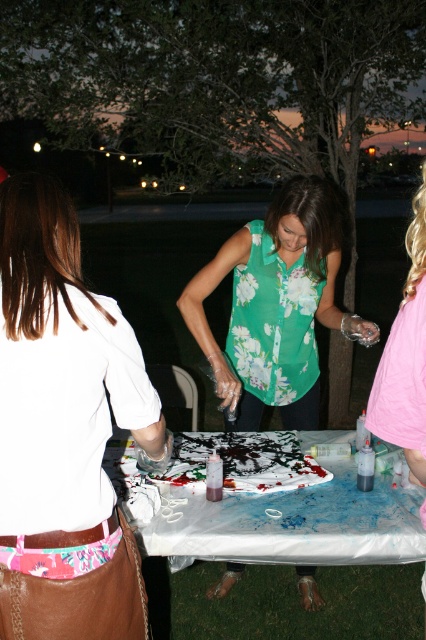
Is white plastic picnic table at center below floral fabric blouse at center?

Correct, white plastic picnic table at center is located below floral fabric blouse at center.

Does white plastic picnic table at center lie in front of floral fabric blouse at center?

No, white plastic picnic table at center is behind floral fabric blouse at center.

This screenshot has width=426, height=640. What do you see at coordinates (288, 563) in the screenshot?
I see `white plastic picnic table at center` at bounding box center [288, 563].

Locate an element on the screen. The width and height of the screenshot is (426, 640). white plastic picnic table at center is located at coordinates (288, 563).

Does point (75, 294) come behind point (380, 368)?

No.

Which is more to the right, white leather purse at lower left or floral fabric blouse at center?

floral fabric blouse at center is more to the right.

This screenshot has height=640, width=426. I want to click on white leather purse at lower left, so click(65, 429).

Who is shorter, white leather purse at lower left or floral green blouse at center?

Standing shorter between the two is white leather purse at lower left.

Is white leather purse at lower left bigger than floral green blouse at center?

No.

Who is more forward, (48, 477) or (209, 282)?

Point (48, 477)

Locate an element on the screen. The image size is (426, 640). white leather purse at lower left is located at coordinates (65, 429).